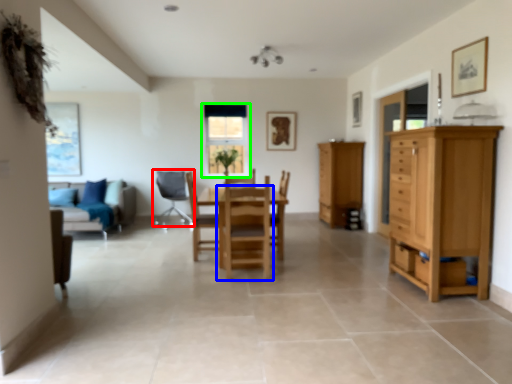
Question: Estimate the real-world distances between objects in this image. Which object is closer to chair (highlighted by a red box), chair (highlighted by a blue box) or window (highlighted by a green box)?

Choices:
 (A) chair
 (B) window

Answer: (B)